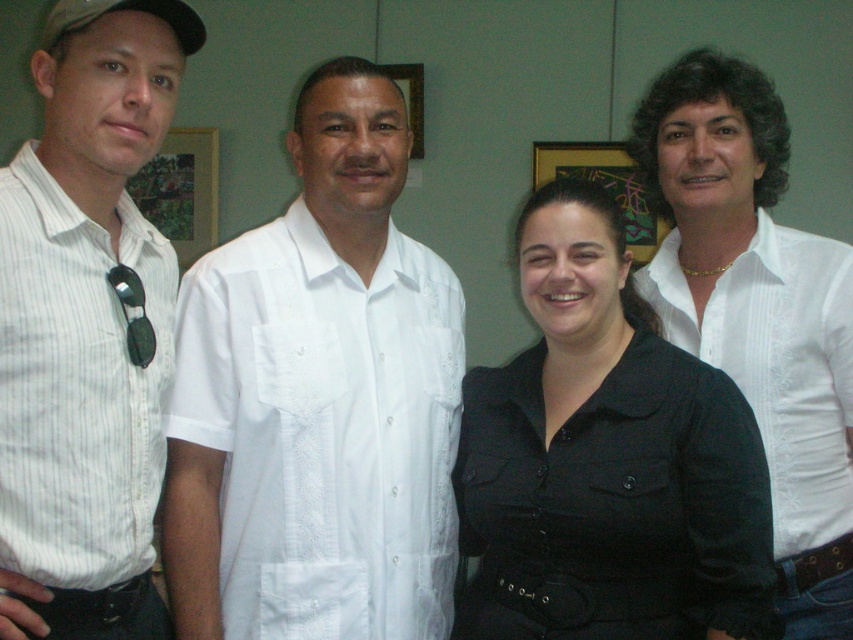
Based on the photo, based on the scene description, which object is taller between the black matte shirt at center and the wooden frame at upper center?

The black matte shirt at center is much taller than the wooden frame at upper center.

Based on the scene description, where is the point located at coordinates point (85, 320)?

The point at coordinates point (85, 320) corresponds to the white striped shirt at left.

Based on the scene description, which object is closer to the viewer between the white striped shirt at left and the brushed metal picture frame at left?

The white striped shirt at left is closer to the viewer because it is in front of the brushed metal picture frame at left.